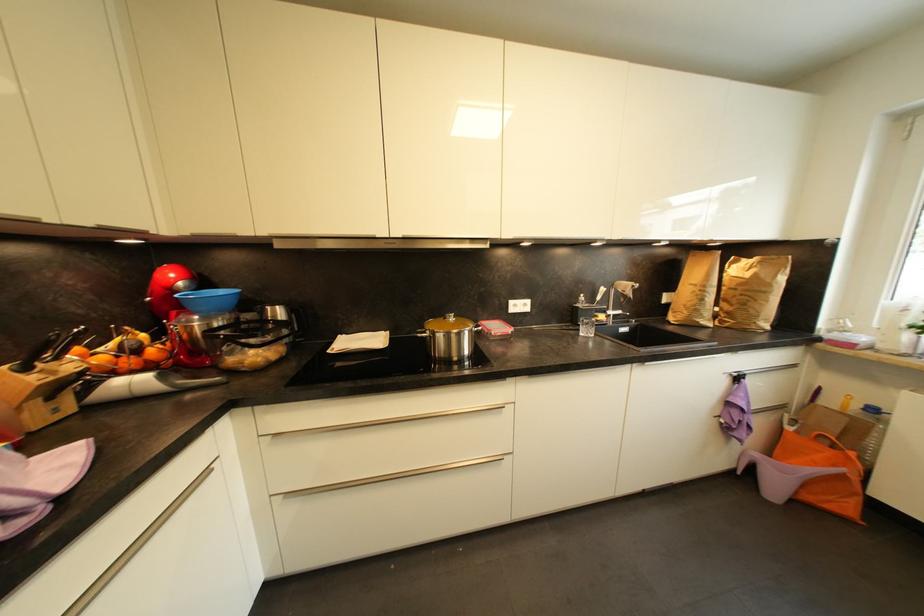
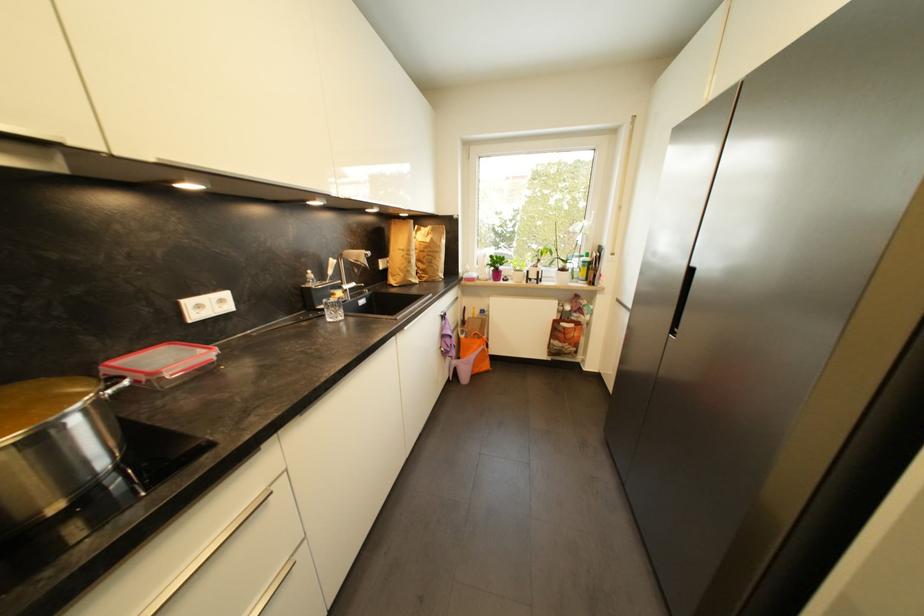
Find the pixel in the second image that matches point (494, 331) in the first image.

(162, 375)